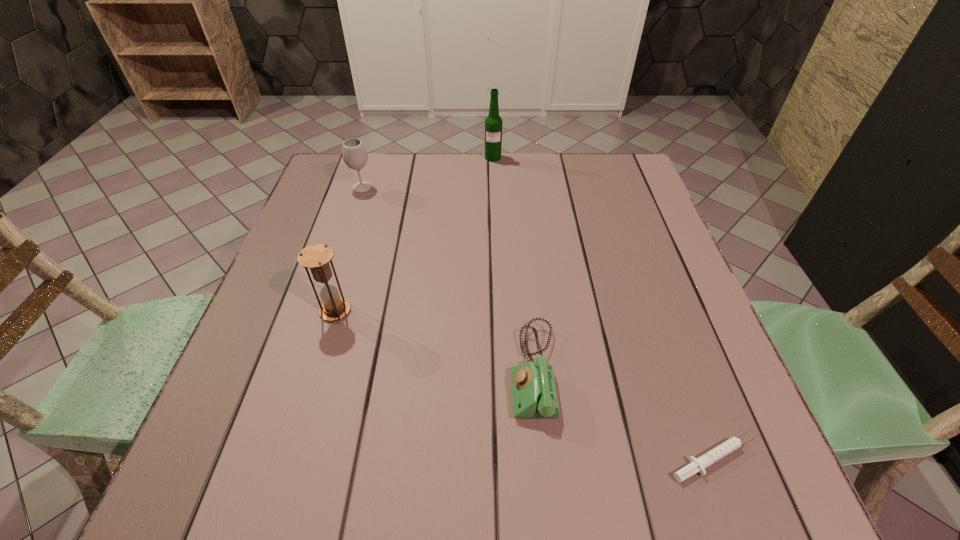
Where is `the farthest object`? the farthest object is located at coordinates [x=493, y=123].

The image size is (960, 540). What are the coordinates of `beer bottle` in the screenshot? It's located at (493, 123).

You are a GUI agent. You are given a task and a screenshot of the screen. Output one action in this format:
    pyautogui.click(x=<x>, y=<y>)
    Task: Click on the hourglass
    This screenshot has width=960, height=540.
    Given the screenshot: What is the action you would take?
    pyautogui.click(x=316, y=257)

I want to click on the second tallest object, so click(x=316, y=257).

Locate an element on the screen. The width and height of the screenshot is (960, 540). the second farthest object is located at coordinates (355, 156).

Where is `wineglass`? The height and width of the screenshot is (540, 960). wineglass is located at coordinates (355, 156).

This screenshot has width=960, height=540. Identify the location of the fourth tallest object. (534, 391).

Where is `the fourth farthest object`? The width and height of the screenshot is (960, 540). the fourth farthest object is located at coordinates pyautogui.click(x=534, y=391).

Image resolution: width=960 pixels, height=540 pixels. I want to click on the nearest object, so click(698, 465).

You are a GUI agent. You are given a task and a screenshot of the screen. Output one action in this format:
    pyautogui.click(x=<x>, y=<y>)
    Task: Click on the shortest object
    
    Given the screenshot: What is the action you would take?
    point(698,465)